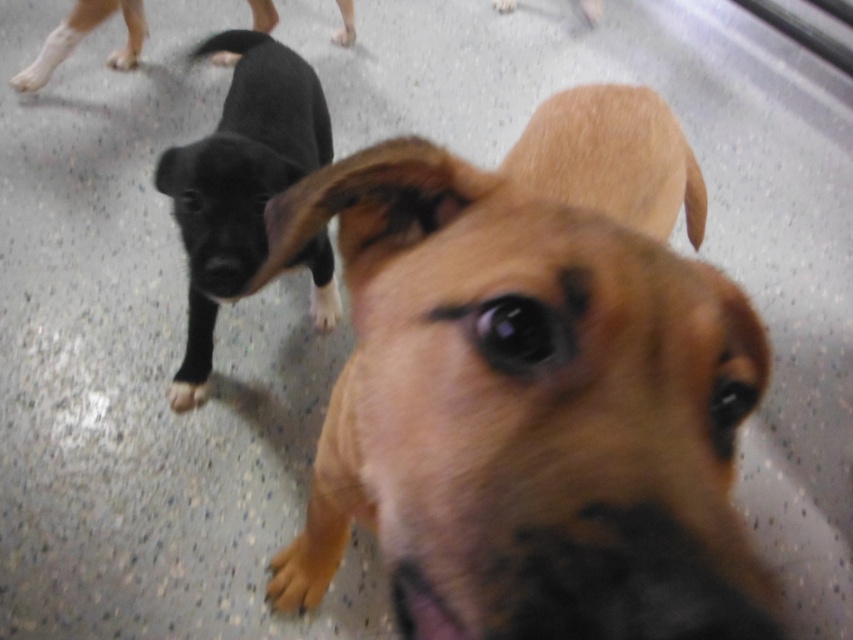
Based on the photo, you are a dog trainer observing two puppies. You need to determine which one is shorter. The brown furry dog at center and the shiny black puppy at left are in your view. Which puppy is shorter?

The brown furry dog at center is shorter than the shiny black puppy at left.